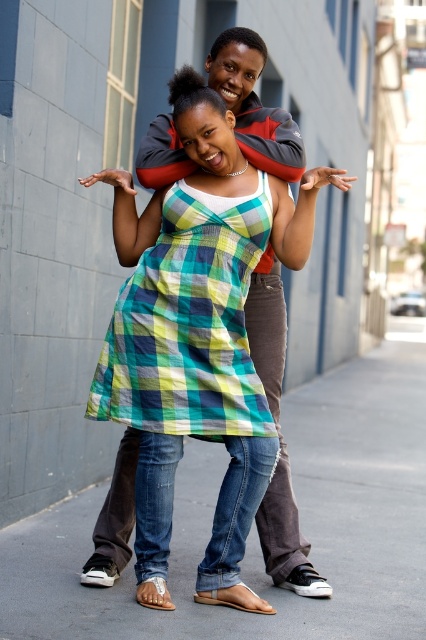
Question: Does green plaid dress at center appear on the left side of plaid fabric dress at center?

Choices:
 (A) no
 (B) yes

Answer: (A)

Question: Which of these objects is positioned closest to the smooth concrete pavement at center?

Choices:
 (A) plaid fabric dress at center
 (B) green plaid dress at center

Answer: (B)

Question: Estimate the real-world distances between objects in this image. Which object is farther from the smooth concrete pavement at center?

Choices:
 (A) plaid fabric dress at center
 (B) green plaid dress at center

Answer: (A)

Question: Considering the relative positions of smooth concrete pavement at center and green plaid dress at center in the image provided, where is smooth concrete pavement at center located with respect to green plaid dress at center?

Choices:
 (A) left
 (B) right

Answer: (B)

Question: Which point is closer to the camera?

Choices:
 (A) plaid fabric dress at center
 (B) smooth concrete pavement at center

Answer: (B)

Question: Is smooth concrete pavement at center thinner than plaid fabric dress at center?

Choices:
 (A) yes
 (B) no

Answer: (B)